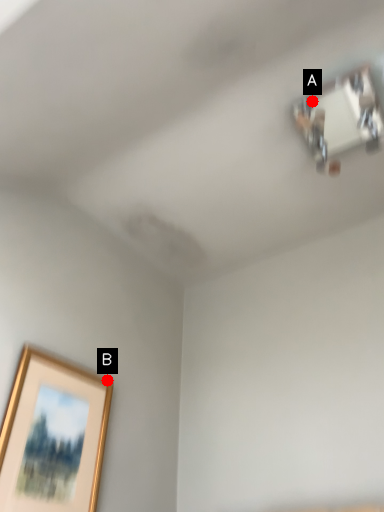
Question: Two points are circled on the image, labeled by A and B beside each circle. Which of the following is the farthest from the observer?

Choices:
 (A) A is further
 (B) B is further

Answer: (B)